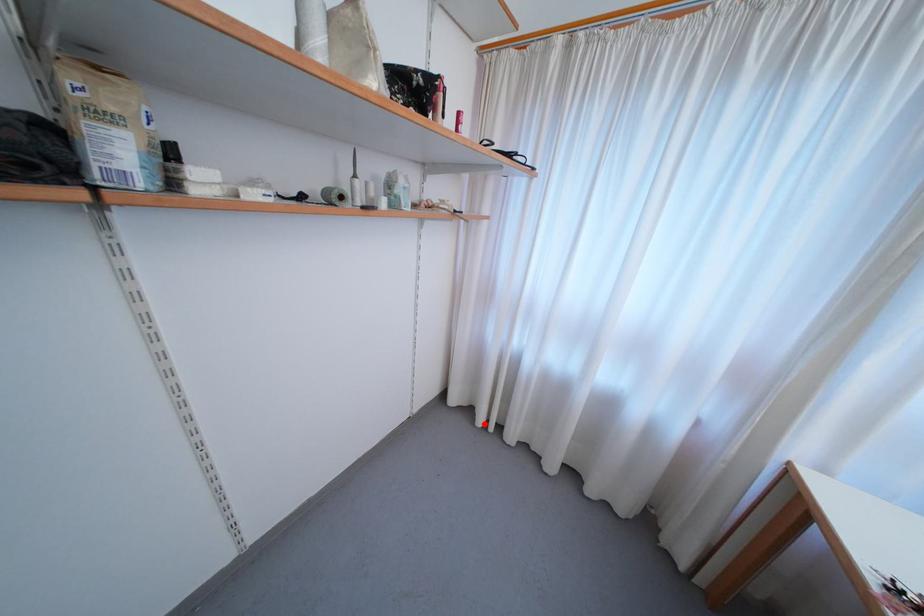
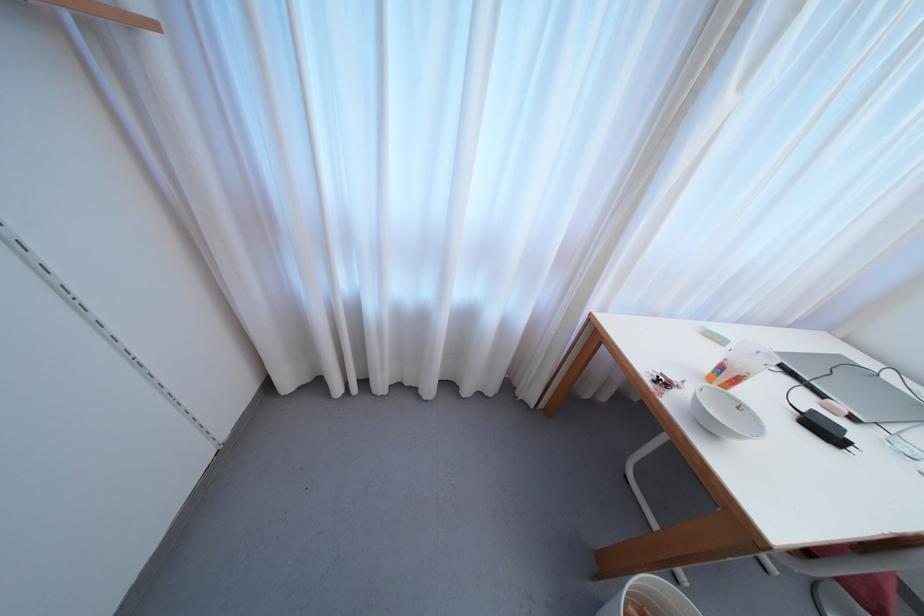
Question: I am providing you with two images of the same scene from different viewpoints. A red point is shown in image1. For the corresponding object point in image2, is it positioned nearer or farther from the camera?

Choices:
 (A) Nearer
 (B) Farther

Answer: (B)